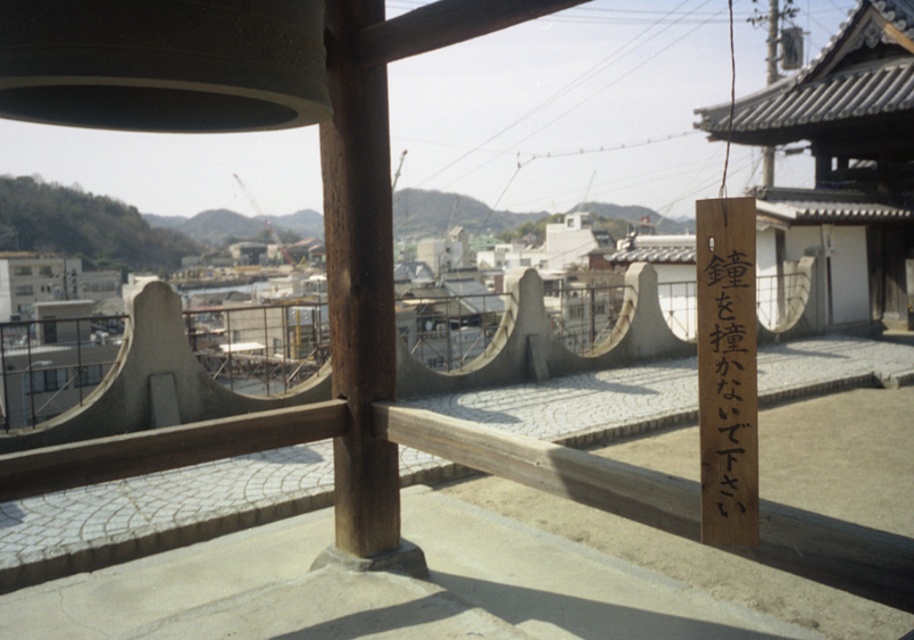
Who is lower down, smooth brown wooden post at center or black wood sign at center right?

black wood sign at center right

Describe the element at coordinates (359, 285) in the screenshot. I see `smooth brown wooden post at center` at that location.

Find the location of a particular element. The width and height of the screenshot is (914, 640). smooth brown wooden post at center is located at coordinates (359, 285).